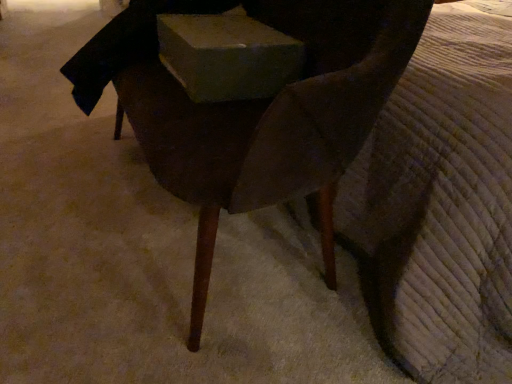
Question: Considering the relative sizes of matte gray box at center and dark wood chair at center in the image provided, is matte gray box at center shorter than dark wood chair at center?

Choices:
 (A) no
 (B) yes

Answer: (B)

Question: Does matte gray box at center have a greater width compared to dark wood chair at center?

Choices:
 (A) no
 (B) yes

Answer: (A)

Question: Is matte gray box at center touching dark wood chair at center?

Choices:
 (A) no
 (B) yes

Answer: (A)

Question: Does matte gray box at center appear on the right side of dark wood chair at center?

Choices:
 (A) no
 (B) yes

Answer: (B)

Question: From the image's perspective, is matte gray box at center over dark wood chair at center?

Choices:
 (A) no
 (B) yes

Answer: (B)

Question: Can you confirm if matte gray box at center is positioned to the left of dark wood chair at center?

Choices:
 (A) no
 (B) yes

Answer: (A)

Question: Does dark wood chair at center appear on the left side of matte gray box at center?

Choices:
 (A) yes
 (B) no

Answer: (A)

Question: Is dark wood chair at center behind matte gray box at center?

Choices:
 (A) yes
 (B) no

Answer: (B)

Question: Considering the relative positions of dark wood chair at center and matte gray box at center in the image provided, is dark wood chair at center in front of matte gray box at center?

Choices:
 (A) no
 (B) yes

Answer: (B)

Question: Does dark wood chair at center have a greater width compared to matte gray box at center?

Choices:
 (A) yes
 (B) no

Answer: (A)

Question: Considering the relative sizes of dark wood chair at center and matte gray box at center in the image provided, is dark wood chair at center shorter than matte gray box at center?

Choices:
 (A) no
 (B) yes

Answer: (A)

Question: Is dark wood chair at center thinner than matte gray box at center?

Choices:
 (A) no
 (B) yes

Answer: (A)

Question: In terms of size, does matte gray box at center appear bigger or smaller than dark wood chair at center?

Choices:
 (A) small
 (B) big

Answer: (A)